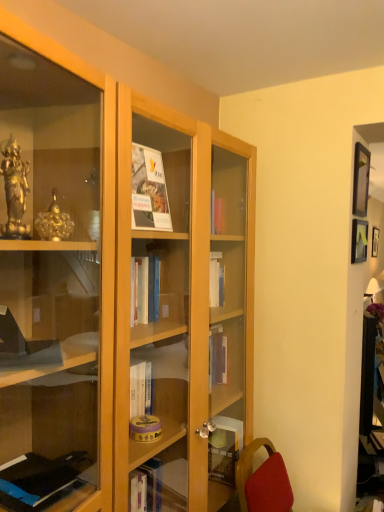
Question: Is matte black picture frame at upper right, which is the 2th picture frame in top-to-bottom order, wider or thinner than matte black picture frame at upper right, arranged as the second picture frame when ordered from the bottom?

Choices:
 (A) thin
 (B) wide

Answer: (A)

Question: Considering the positions of point tap(359, 260) and point tap(362, 147), is point tap(359, 260) closer or farther from the camera than point tap(362, 147)?

Choices:
 (A) farther
 (B) closer

Answer: (A)

Question: Is matte black picture frame at upper right, which is the 2th picture frame in top-to-bottom order, taller or shorter than matte black picture frame at upper right, arranged as the second picture frame when ordered from the bottom?

Choices:
 (A) tall
 (B) short

Answer: (B)

Question: Is matte black picture frame at upper right, arranged as the second picture frame when ordered from the bottom, situated inside matte black picture frame at upper right, which is the 2th picture frame in top-to-bottom order, or outside?

Choices:
 (A) inside
 (B) outside

Answer: (B)

Question: In terms of width, does matte black picture frame at upper right, the first picture frame viewed from the top, look wider or thinner when compared to matte black picture frame at upper right, which is the 2th picture frame in top-to-bottom order?

Choices:
 (A) thin
 (B) wide

Answer: (B)

Question: Visually, is matte black picture frame at upper right, arranged as the second picture frame when ordered from the bottom, positioned to the left or to the right of matte black picture frame at upper right, which is the 2th picture frame in top-to-bottom order?

Choices:
 (A) left
 (B) right

Answer: (B)

Question: Considering the positions of matte black picture frame at upper right, the first picture frame viewed from the top, and matte black picture frame at upper right, which is the 2th picture frame in top-to-bottom order, in the image, is matte black picture frame at upper right, the first picture frame viewed from the top, bigger or smaller than matte black picture frame at upper right, which is the 2th picture frame in top-to-bottom order,?

Choices:
 (A) big
 (B) small

Answer: (A)